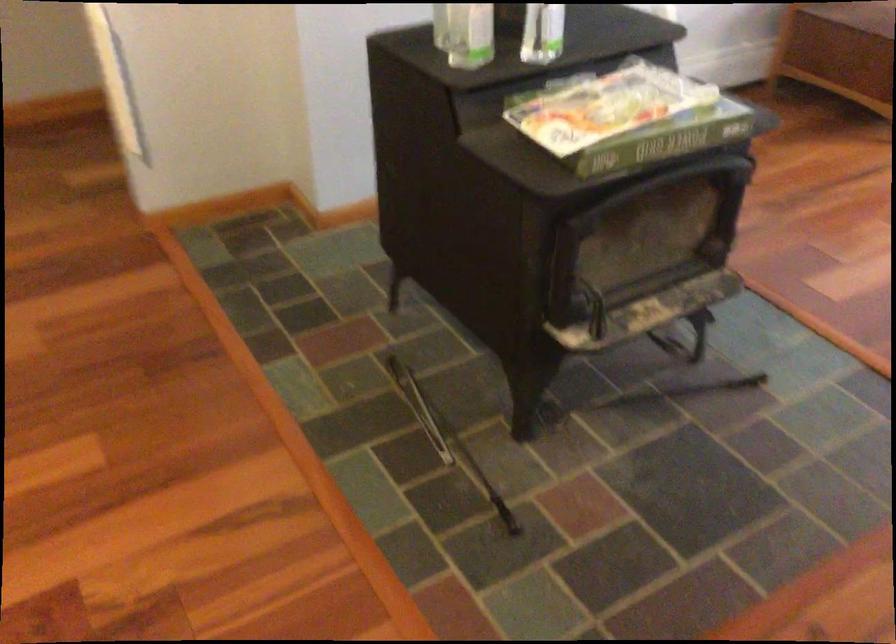
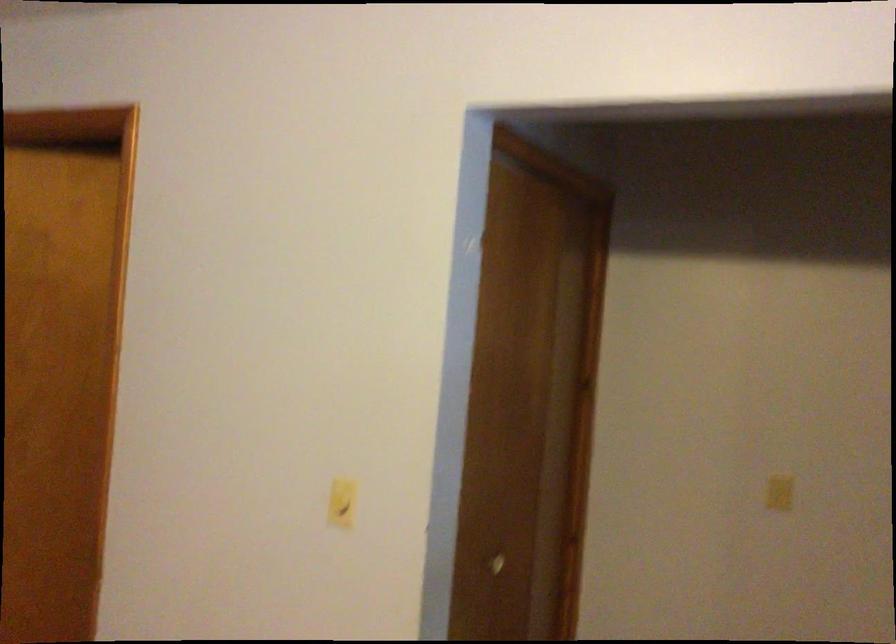
The first image is from the beginning of the video and the second image is from the end. How did the camera likely rotate when shooting the video?

The camera rotated toward left-up.